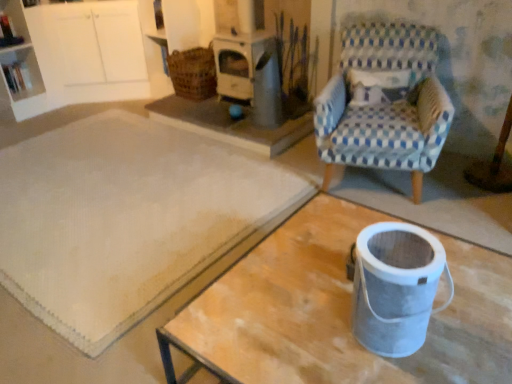
Question: Considering the relative positions of woven brown basket at upper center and metallic gray bucket at lower right in the image provided, is woven brown basket at upper center to the left or to the right of metallic gray bucket at lower right?

Choices:
 (A) right
 (B) left

Answer: (B)

Question: From a real-world perspective, relative to metallic gray bucket at lower right, is woven brown basket at upper center vertically above or below?

Choices:
 (A) below
 (B) above

Answer: (A)

Question: Estimate the real-world distances between objects in this image. Which object is closer to the blue checkered fabric chair at upper right?

Choices:
 (A) white plastic shelf at upper left
 (B) white textured rug at center
 (C) metallic gray bucket at lower right
 (D) woven brown basket at upper center

Answer: (B)

Question: Which object is positioned closest to the blue checkered fabric chair at upper right?

Choices:
 (A) white plastic shelf at upper left
 (B) white textured rug at center
 (C) woven brown basket at upper center
 (D) metallic gray bucket at lower right

Answer: (B)